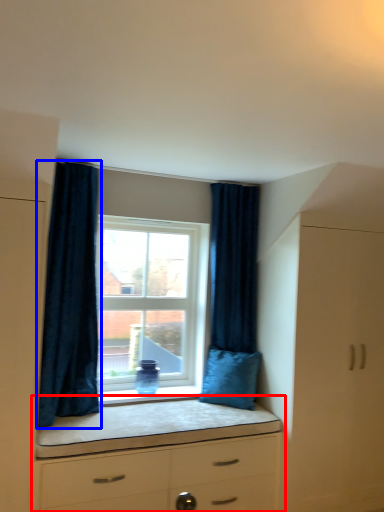
Question: Which of the following is the closest to the observer, chest of drawers (highlighted by a red box) or curtain (highlighted by a blue box)?

Choices:
 (A) chest of drawers
 (B) curtain

Answer: (A)